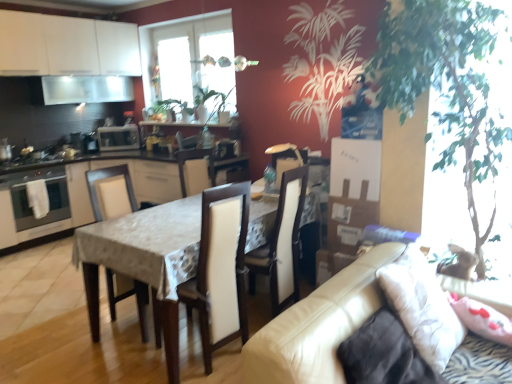
Question: Is white leather chair at center, the 1th chair viewed from the right, turned away from satin silver oven at left?

Choices:
 (A) yes
 (B) no

Answer: (B)

Question: Does white leather chair at center, placed as the 3th chair when sorted from left to right, touch satin silver oven at left?

Choices:
 (A) yes
 (B) no

Answer: (B)

Question: Is white leather chair at center, the 1th chair viewed from the right, further to camera compared to satin silver oven at left?

Choices:
 (A) yes
 (B) no

Answer: (B)

Question: From a real-world perspective, is white leather chair at center, placed as the 3th chair when sorted from left to right, positioned under satin silver oven at left based on gravity?

Choices:
 (A) no
 (B) yes

Answer: (B)

Question: From a real-world perspective, is white leather chair at center, placed as the 3th chair when sorted from left to right, physically above satin silver oven at left?

Choices:
 (A) yes
 (B) no

Answer: (B)

Question: Considering the positions of point (16, 203) and point (132, 195), is point (16, 203) closer or farther from the camera than point (132, 195)?

Choices:
 (A) farther
 (B) closer

Answer: (A)

Question: From the image's perspective, relative to white glossy cabinets at center, the 1th cabinetry ordered from the bottom, is satin silver oven at left above or below?

Choices:
 (A) below
 (B) above

Answer: (B)

Question: Is satin silver oven at left wider or thinner than white glossy cabinets at center, the 1th cabinetry ordered from the bottom?

Choices:
 (A) wide
 (B) thin

Answer: (B)

Question: Considering the relative positions of satin silver oven at left and white glossy cabinets at center, positioned as the 2th cabinetry in top-to-bottom order, in the image provided, is satin silver oven at left to the left or to the right of white glossy cabinets at center, positioned as the 2th cabinetry in top-to-bottom order,?

Choices:
 (A) right
 (B) left

Answer: (B)

Question: Does point (479, 246) appear closer or farther from the camera than point (105, 216)?

Choices:
 (A) closer
 (B) farther

Answer: (A)

Question: Is green leafy plant at right bigger or smaller than white fabric chair at center, arranged as the third chair when viewed from the right?

Choices:
 (A) small
 (B) big

Answer: (B)

Question: From the image's perspective, is green leafy plant at right located above or below white fabric chair at center, arranged as the third chair when viewed from the right?

Choices:
 (A) above
 (B) below

Answer: (A)

Question: Is green leafy plant at right to the left or to the right of white fabric chair at center, arranged as the third chair when viewed from the right, in the image?

Choices:
 (A) right
 (B) left

Answer: (A)

Question: Is leather couch at lower right situated inside white fabric pillow at right or outside?

Choices:
 (A) outside
 (B) inside

Answer: (A)

Question: Looking at their shapes, would you say leather couch at lower right is wider or thinner than white fabric pillow at right?

Choices:
 (A) thin
 (B) wide

Answer: (B)